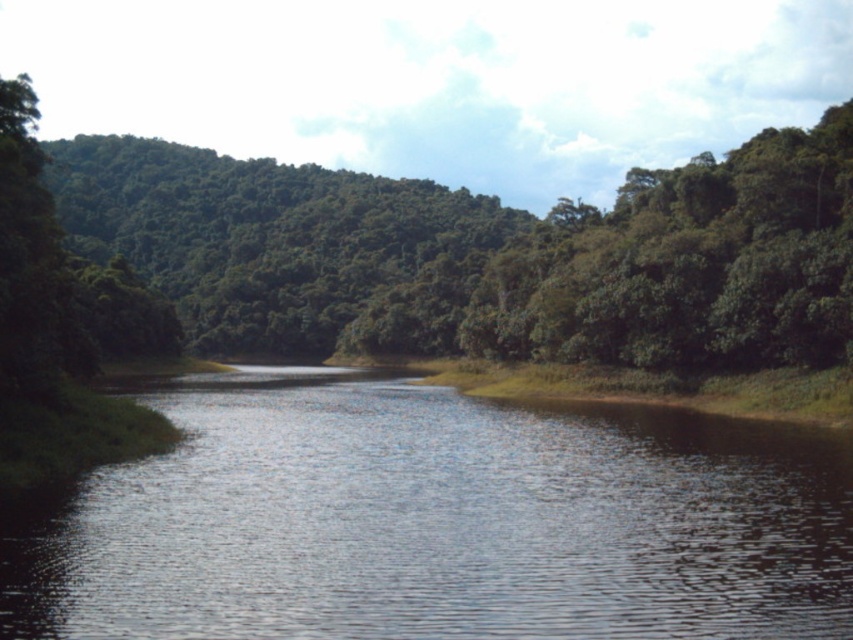
Question: From the image, what is the correct spatial relationship of shiny dark water at center in relation to green leafy tree at center?

Choices:
 (A) below
 (B) above

Answer: (A)

Question: Which object is farther from the camera taking this photo?

Choices:
 (A) green leafy tree at center
 (B) shiny dark water at center

Answer: (A)

Question: Which object appears closest to the camera in this image?

Choices:
 (A) green leafy tree at center
 (B) shiny dark water at center

Answer: (B)

Question: Can you confirm if shiny dark water at center is positioned to the left of green leafy tree at center?

Choices:
 (A) no
 (B) yes

Answer: (A)

Question: Is shiny dark water at center positioned behind green leafy tree at center?

Choices:
 (A) no
 (B) yes

Answer: (A)